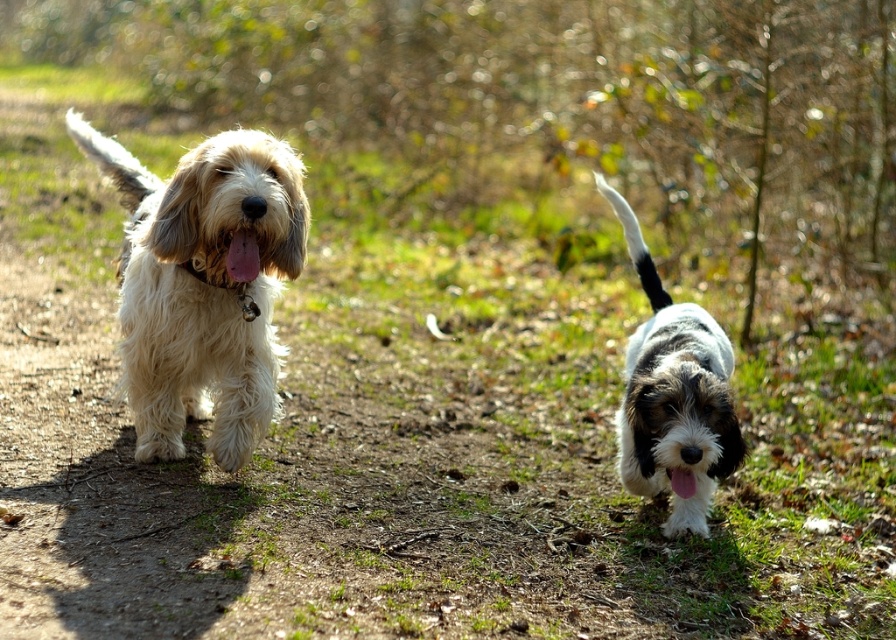
Question: In this image, where is fluffy white dog at center located relative to white fur dog at right?

Choices:
 (A) above
 (B) below

Answer: (A)

Question: Which object is the farthest from the fluffy white dog at center?

Choices:
 (A) white fur dog at right
 (B) black and white fur tail at right
 (C) white fluffy tail at left

Answer: (B)

Question: Which point is closer to the camera?

Choices:
 (A) white fluffy tail at left
 (B) fluffy white dog at center

Answer: (B)

Question: Can you confirm if white fur dog at right is positioned below black and white fur tail at right?

Choices:
 (A) yes
 (B) no

Answer: (A)

Question: Which object is the farthest from the white fluffy tail at left?

Choices:
 (A) fluffy white dog at center
 (B) white fur dog at right

Answer: (B)

Question: Is fluffy white dog at center thinner than black and white fur tail at right?

Choices:
 (A) yes
 (B) no

Answer: (B)